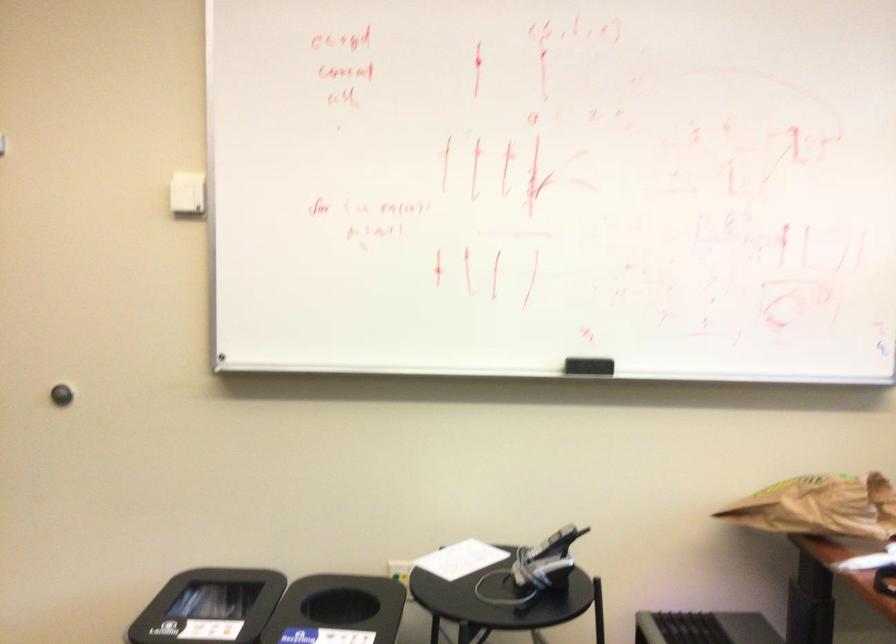
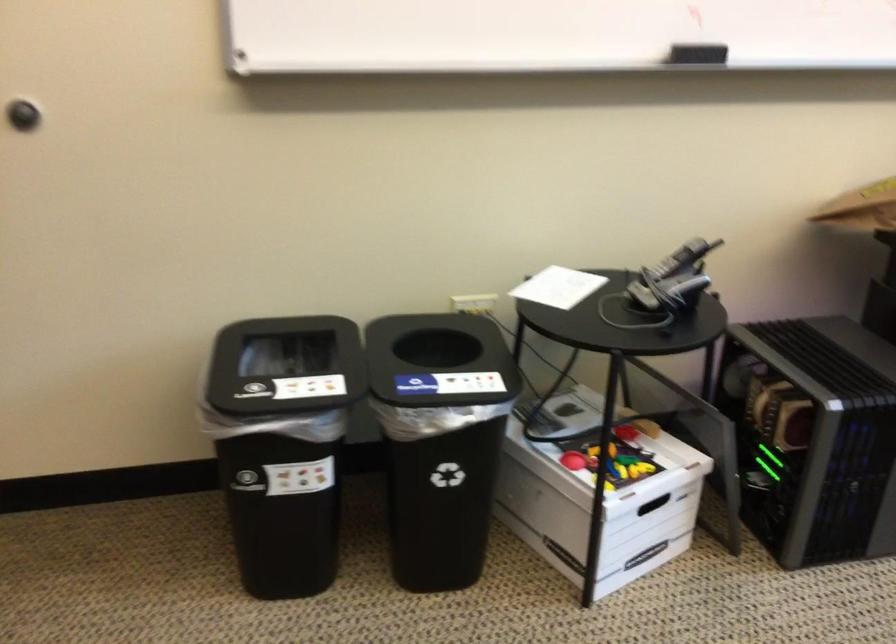
Find the pixel in the second image that matches (x=452, y=556) in the first image.

(558, 287)